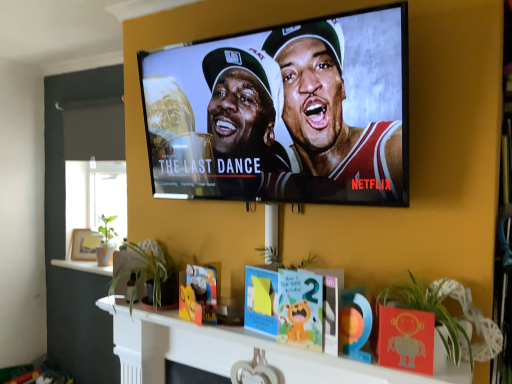
Question: Is matte black tv at upper center not within wooden photo frame at left?

Choices:
 (A) no
 (B) yes

Answer: (B)

Question: Is matte black tv at upper center aimed at wooden photo frame at left?

Choices:
 (A) yes
 (B) no

Answer: (B)

Question: From the image's perspective, is matte black tv at upper center below wooden photo frame at left?

Choices:
 (A) no
 (B) yes

Answer: (A)

Question: Does matte black tv at upper center have a lesser height compared to wooden photo frame at left?

Choices:
 (A) no
 (B) yes

Answer: (A)

Question: Is matte black tv at upper center bigger than wooden photo frame at left?

Choices:
 (A) no
 (B) yes

Answer: (B)

Question: Do you think green leafy plant at lower center, which ranks as the first plant in left-to-right order, is within green leafy plant at lower right, placed as the 1th plant when sorted from right to left, or outside of it?

Choices:
 (A) outside
 (B) inside

Answer: (A)

Question: Considering the positions of green leafy plant at lower center, which is the 2th plant from right to left, and green leafy plant at lower right, placed as the 1th plant when sorted from right to left, in the image, is green leafy plant at lower center, which is the 2th plant from right to left, taller or shorter than green leafy plant at lower right, placed as the 1th plant when sorted from right to left,?

Choices:
 (A) tall
 (B) short

Answer: (A)

Question: Is point (x=119, y=264) closer or farther from the camera than point (x=414, y=344)?

Choices:
 (A) closer
 (B) farther

Answer: (B)

Question: In terms of size, does green leafy plant at lower center, which is the 2th plant from right to left, appear bigger or smaller than green leafy plant at lower right, the first plant positioned from the front?

Choices:
 (A) big
 (B) small

Answer: (B)

Question: In the image, is wooden photo frame at left on the left side or the right side of wooden heart-shaped ornament at center?

Choices:
 (A) right
 (B) left

Answer: (B)

Question: Is wooden photo frame at left wider or thinner than wooden heart-shaped ornament at center?

Choices:
 (A) wide
 (B) thin

Answer: (A)

Question: In terms of height, does wooden photo frame at left look taller or shorter compared to wooden heart-shaped ornament at center?

Choices:
 (A) short
 (B) tall

Answer: (B)

Question: Is wooden photo frame at left spatially inside wooden heart-shaped ornament at center, or outside of it?

Choices:
 (A) outside
 (B) inside

Answer: (A)

Question: Considering their positions, is wooden heart-shaped ornament at center located in front of or behind matte black tv at upper center?

Choices:
 (A) behind
 (B) front

Answer: (A)

Question: In terms of height, does wooden heart-shaped ornament at center look taller or shorter compared to matte black tv at upper center?

Choices:
 (A) tall
 (B) short

Answer: (B)